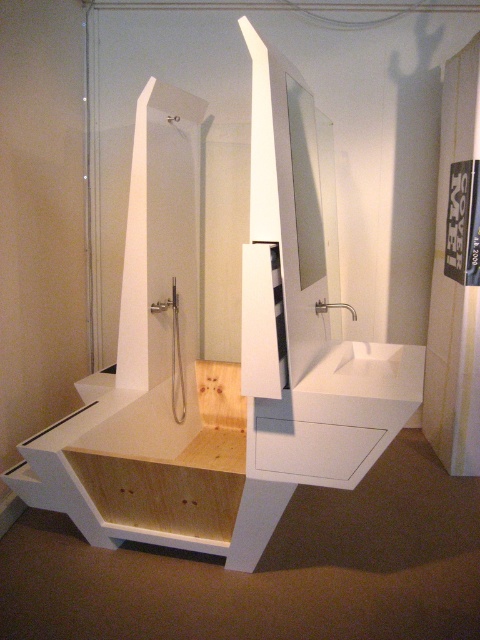
Question: Is white matte sink at center to the right of clear glass mirror at center from the viewer's perspective?

Choices:
 (A) no
 (B) yes

Answer: (B)

Question: Is white matte sink at center in front of clear glass mirror at center?

Choices:
 (A) yes
 (B) no

Answer: (A)

Question: Can you confirm if white matte sink at center is positioned above clear glass mirror at center?

Choices:
 (A) yes
 (B) no

Answer: (B)